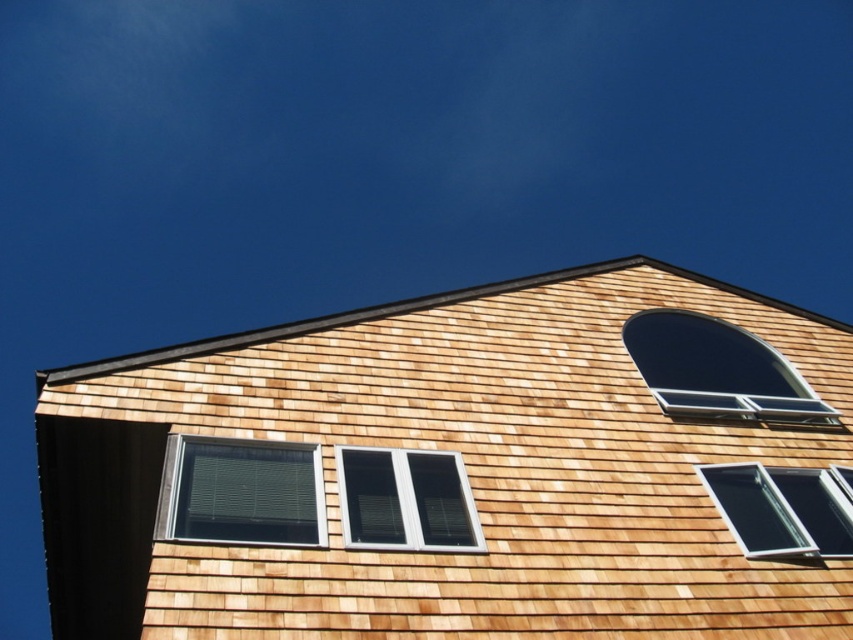
Does matte glass window at lower left have a greater width compared to white plastic window at center?

Indeed, matte glass window at lower left has a greater width compared to white plastic window at center.

Can you confirm if matte glass window at lower left is positioned to the right of white plastic window at center?

In fact, matte glass window at lower left is to the left of white plastic window at center.

Where is `matte glass window at lower left`? Image resolution: width=853 pixels, height=640 pixels. matte glass window at lower left is located at coordinates (241, 492).

At what (x,y) coordinates should I click in order to perform the action: click on matte glass window at lower left. Please return your answer as a coordinate pair (x, y). The image size is (853, 640). Looking at the image, I should click on (241, 492).

Does dark glass window at upper right appear over white plastic window at center?

Indeed, dark glass window at upper right is positioned over white plastic window at center.

Is dark glass window at upper right thinner than white plastic window at center?

Correct, dark glass window at upper right's width is less than white plastic window at center's.

Is point (799, 388) positioned in front of point (370, 522)?

No, it is not.

In order to click on dark glass window at upper right in this screenshot , I will do `click(717, 371)`.

Who is taller, matte glass window at lower left or dark glass window at upper right?

matte glass window at lower left

Which is more to the right, matte glass window at lower left or dark glass window at upper right?

dark glass window at upper right

What do you see at coordinates (241, 492) in the screenshot? I see `matte glass window at lower left` at bounding box center [241, 492].

The height and width of the screenshot is (640, 853). I want to click on matte glass window at lower left, so click(x=241, y=492).